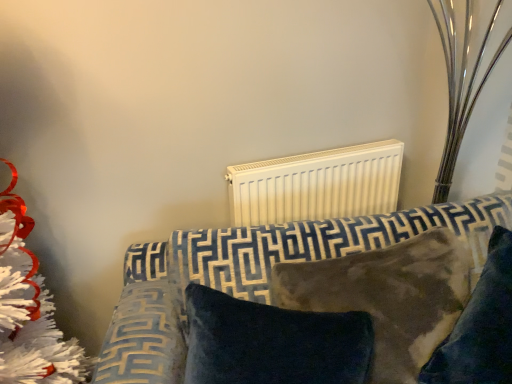
Question: Which direction should I rotate to look at velvety brown pillow at center, which appears as the first pillow when viewed from the right?

Choices:
 (A) right
 (B) left

Answer: (A)

Question: Is velvet-patterned sofa at center behind velvety brown pillow at center, which appears as the first pillow when viewed from the right?

Choices:
 (A) yes
 (B) no

Answer: (B)

Question: Are velvet-patterned sofa at center and velvety brown pillow at center, the second pillow in the left-to-right sequence, beside each other?

Choices:
 (A) yes
 (B) no

Answer: (B)

Question: Is velvet-patterned sofa at center taller than velvety brown pillow at center, the second pillow in the left-to-right sequence?

Choices:
 (A) no
 (B) yes

Answer: (B)

Question: From a real-world perspective, does velvet-patterned sofa at center sit lower than velvety brown pillow at center, the second pillow in the left-to-right sequence?

Choices:
 (A) no
 (B) yes

Answer: (B)

Question: Is velvet-patterned sofa at center to the right of velvety brown pillow at center, which appears as the first pillow when viewed from the right, from the viewer's perspective?

Choices:
 (A) yes
 (B) no

Answer: (B)

Question: Is velvety brown pillow at center, which appears as the first pillow when viewed from the right, a part of velvet-patterned sofa at center?

Choices:
 (A) no
 (B) yes

Answer: (B)

Question: Is white matte radiator at upper center smaller than velvet-patterned sofa at center?

Choices:
 (A) yes
 (B) no

Answer: (A)

Question: Considering the relative sizes of white matte radiator at upper center and velvet-patterned sofa at center in the image provided, is white matte radiator at upper center bigger than velvet-patterned sofa at center?

Choices:
 (A) no
 (B) yes

Answer: (A)

Question: Considering the relative positions of white matte radiator at upper center and velvet-patterned sofa at center in the image provided, is white matte radiator at upper center to the left of velvet-patterned sofa at center from the viewer's perspective?

Choices:
 (A) yes
 (B) no

Answer: (A)

Question: From the image's perspective, would you say white matte radiator at upper center is positioned over velvet-patterned sofa at center?

Choices:
 (A) yes
 (B) no

Answer: (A)

Question: Can you confirm if white matte radiator at upper center is taller than velvet-patterned sofa at center?

Choices:
 (A) no
 (B) yes

Answer: (A)

Question: Is the depth of white matte radiator at upper center greater than that of velvet-patterned sofa at center?

Choices:
 (A) yes
 (B) no

Answer: (A)

Question: Is velvet-patterned sofa at center shorter than velvet dark blue pillow at center, marked as the 2th pillow in a right-to-left arrangement?

Choices:
 (A) no
 (B) yes

Answer: (A)